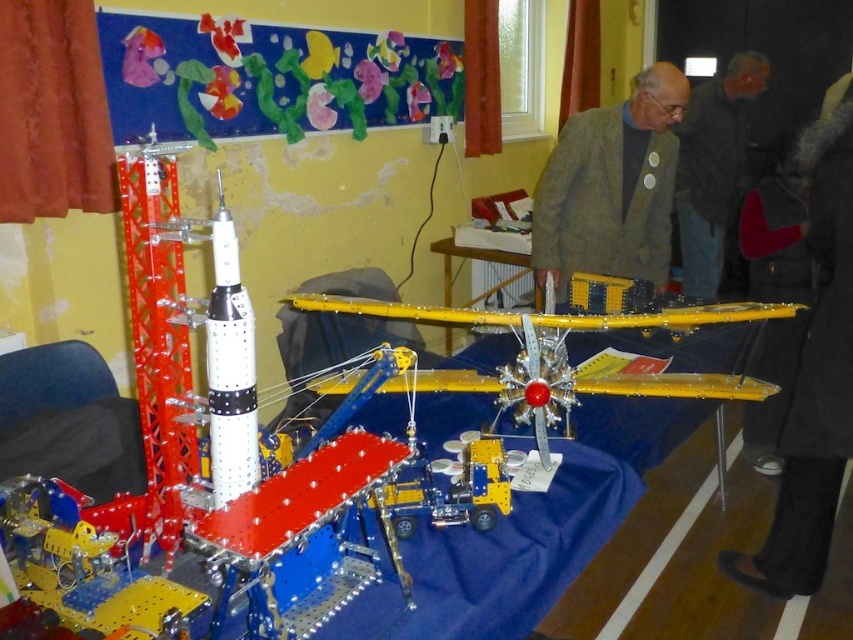
Which is in front, point (828, 131) or point (486, 296)?

Point (828, 131) is more forward.

At what (x,y) coordinates should I click in order to perform the action: click on black fuzzy coat at lower right. Please return your answer as a coordinate pair (x, y). This screenshot has height=640, width=853. Looking at the image, I should click on (813, 381).

Image resolution: width=853 pixels, height=640 pixels. I want to click on black fuzzy coat at lower right, so click(813, 381).

Who is lower down, dark brown leather jacket at upper right or white metallic rocket at center?

white metallic rocket at center

Who is higher up, dark brown leather jacket at upper right or white metallic rocket at center?

dark brown leather jacket at upper right is above.

This screenshot has width=853, height=640. In order to click on dark brown leather jacket at upper right in this screenshot , I will do `click(712, 168)`.

Does green textured blazer at center appear on the right side of yellow metallic airplane at center?

Yes, green textured blazer at center is to the right of yellow metallic airplane at center.

Is green textured blazer at center below yellow metallic airplane at center?

No.

Where is `green textured blazer at center`? green textured blazer at center is located at coordinates (611, 186).

I want to click on green textured blazer at center, so click(x=611, y=186).